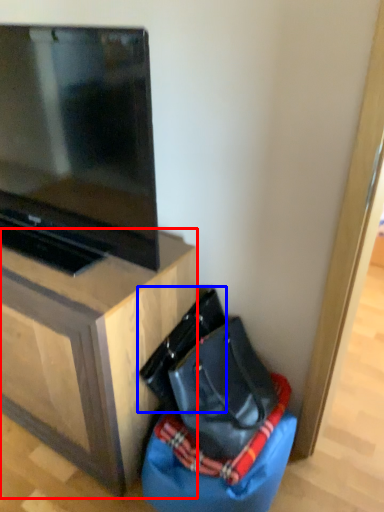
Question: Which object appears farthest to the camera in this image, furniture (highlighted by a red box) or messenger bag (highlighted by a blue box)?

Choices:
 (A) furniture
 (B) messenger bag

Answer: (B)